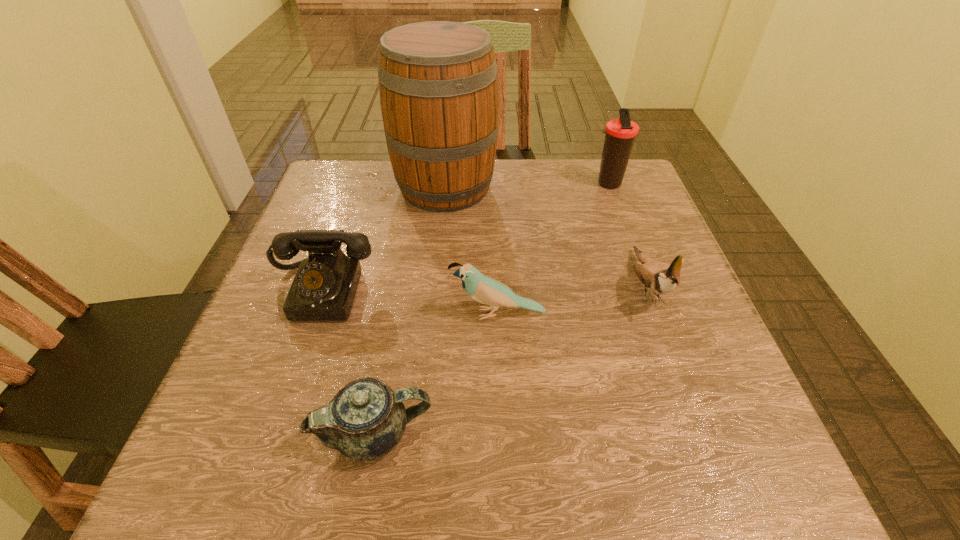
Where is `bird situated at the right edge`? The height and width of the screenshot is (540, 960). bird situated at the right edge is located at coordinates [659, 277].

Locate an element on the screen. This screenshot has height=540, width=960. object located at the far right corner is located at coordinates click(620, 133).

The height and width of the screenshot is (540, 960). What are the coordinates of `free space at the far edge of the desktop` in the screenshot? It's located at (387, 181).

In the image, there is a desktop. Where is `free region at the near edge`? The image size is (960, 540). free region at the near edge is located at coordinates (483, 453).

Image resolution: width=960 pixels, height=540 pixels. In order to click on free region at the left edge of the desktop in this screenshot , I will do `click(368, 230)`.

Locate an element on the screen. vacant area at the right edge is located at coordinates (711, 329).

Locate an element on the screen. The image size is (960, 540). vacant space at the far left corner of the desktop is located at coordinates (340, 166).

This screenshot has width=960, height=540. In the image, there is a desktop. Find the location of `free space at the far right corner`. free space at the far right corner is located at coordinates (636, 194).

Locate an element on the screen. This screenshot has width=960, height=540. free space at the near right corner of the desktop is located at coordinates (682, 489).

Identify the location of free space between the telephone and the thermos bottle. (466, 238).